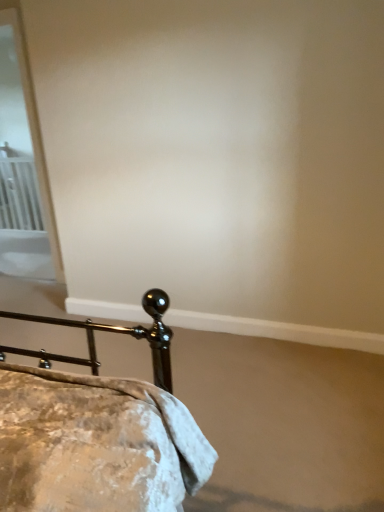
Question: Does point (48, 219) appear closer or farther from the camera than point (13, 175)?

Choices:
 (A) closer
 (B) farther

Answer: (A)

Question: From a real-world perspective, relative to white metal radiator at left, is white glossy screen door at upper left vertically above or below?

Choices:
 (A) above
 (B) below

Answer: (A)

Question: Considering the real-world distances, which object is farthest from the white metal radiator at left?

Choices:
 (A) white glossy screen door at upper left
 (B) metallic gold bed at lower left

Answer: (B)

Question: Which object is the farthest from the white glossy screen door at upper left?

Choices:
 (A) white metal radiator at left
 (B) metallic gold bed at lower left

Answer: (B)